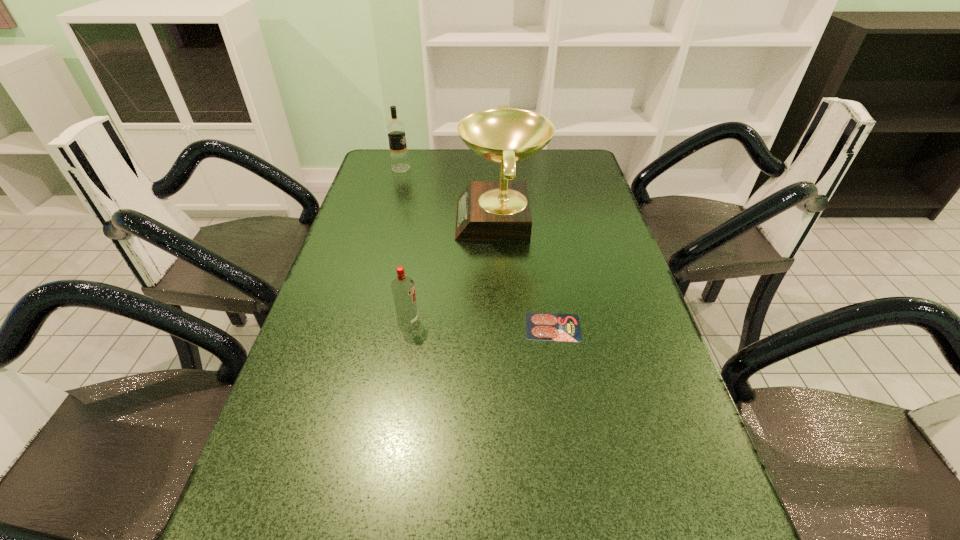
Locate an element on the screen. object that stands as the third closest to the farthest object is located at coordinates (539, 326).

Where is `object that is the third closest to the salami`? object that is the third closest to the salami is located at coordinates (395, 129).

The height and width of the screenshot is (540, 960). I want to click on free point that satisfies the following two spatial constraints: 1. on the label of the leftmost object; 2. on the left side of the salami, so click(358, 327).

Image resolution: width=960 pixels, height=540 pixels. In order to click on vacant space that satisfies the following two spatial constraints: 1. on the label of the farther vodka; 2. on the left side of the shortest object in this screenshot , I will do `click(358, 327)`.

Where is `vacant space that satisfies the following two spatial constraints: 1. on the front-facing side of the salami; 2. on the left side of the second farthest object`? The image size is (960, 540). vacant space that satisfies the following two spatial constraints: 1. on the front-facing side of the salami; 2. on the left side of the second farthest object is located at coordinates (507, 327).

I want to click on vacant point that satisfies the following two spatial constraints: 1. on the front-facing side of the award; 2. on the back side of the salami, so click(x=507, y=327).

Find the location of `vacant space that satisfies the following two spatial constraints: 1. on the front label of the salami; 2. on the right side of the nearer vodka`. vacant space that satisfies the following two spatial constraints: 1. on the front label of the salami; 2. on the right side of the nearer vodka is located at coordinates click(407, 327).

This screenshot has width=960, height=540. Find the location of `free location that satisfies the following two spatial constraints: 1. on the label of the leftmost object; 2. on the left side of the shortest object`. free location that satisfies the following two spatial constraints: 1. on the label of the leftmost object; 2. on the left side of the shortest object is located at coordinates (358, 327).

Find the location of a particular element. This screenshot has width=960, height=540. vacant position in the image that satisfies the following two spatial constraints: 1. on the front label of the salami; 2. on the left side of the nearer vodka is located at coordinates (407, 327).

Identify the location of vacant area in the image that satisfies the following two spatial constraints: 1. on the front-facing side of the shortest object; 2. on the left side of the award. (x=507, y=327).